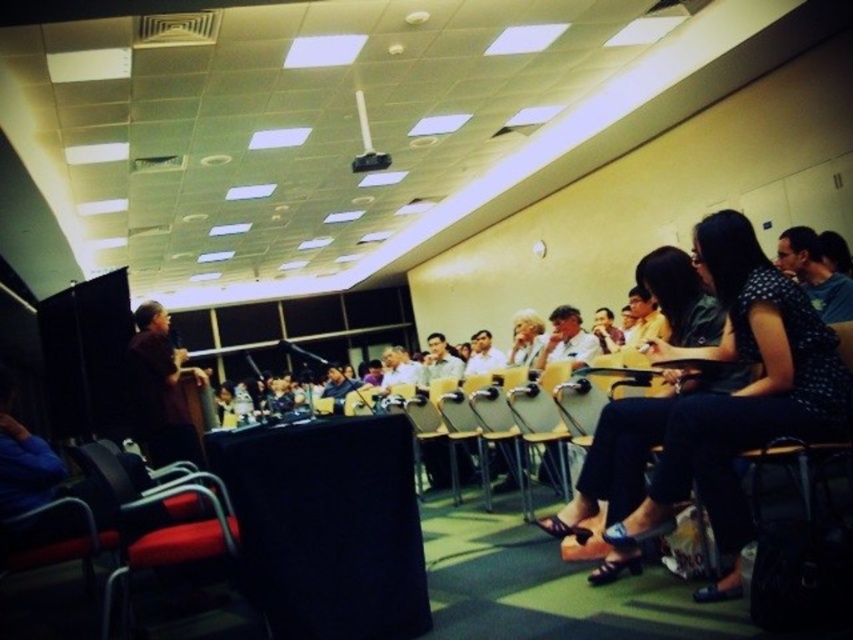
Question: Can you confirm if polka dot blouse at center is positioned to the left of brown shirt at left?

Choices:
 (A) no
 (B) yes

Answer: (A)

Question: Is polka dot blouse at center closer to camera compared to red fabric chair at lower left?

Choices:
 (A) yes
 (B) no

Answer: (B)

Question: Which of these objects is positioned closest to the red fabric chair at lower left?

Choices:
 (A) brown shirt at left
 (B) polka dot blouse at center

Answer: (A)

Question: Which point is closer to the camera taking this photo?

Choices:
 (A) (207, 500)
 (B) (751, 355)

Answer: (B)

Question: Can you confirm if polka dot blouse at center is positioned below brown shirt at left?

Choices:
 (A) yes
 (B) no

Answer: (B)

Question: Which object appears closest to the camera in this image?

Choices:
 (A) brown shirt at left
 (B) red fabric chair at lower left

Answer: (B)